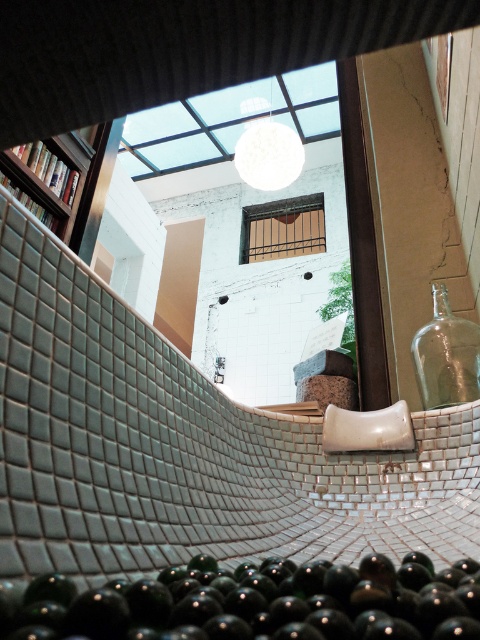
Question: Which point is closer to the camera taking this photo?

Choices:
 (A) (414, 355)
 (B) (194, 612)

Answer: (B)

Question: Is the position of green glass bottle at bottom more distant than that of wooden bookshelf at upper left?

Choices:
 (A) no
 (B) yes

Answer: (A)

Question: Which of these objects is positioned closest to the green glass bottle at bottom?

Choices:
 (A) transparent glass bottle at right
 (B) wooden bookshelf at upper left

Answer: (A)

Question: Among these objects, which one is farthest from the camera?

Choices:
 (A) green glass bottle at bottom
 (B) wooden bookshelf at upper left

Answer: (B)

Question: Can you confirm if green glass bottle at bottom is bigger than transparent glass bottle at right?

Choices:
 (A) no
 (B) yes

Answer: (A)

Question: In this image, where is green glass bottle at bottom located relative to wooden bookshelf at upper left?

Choices:
 (A) below
 (B) above

Answer: (A)